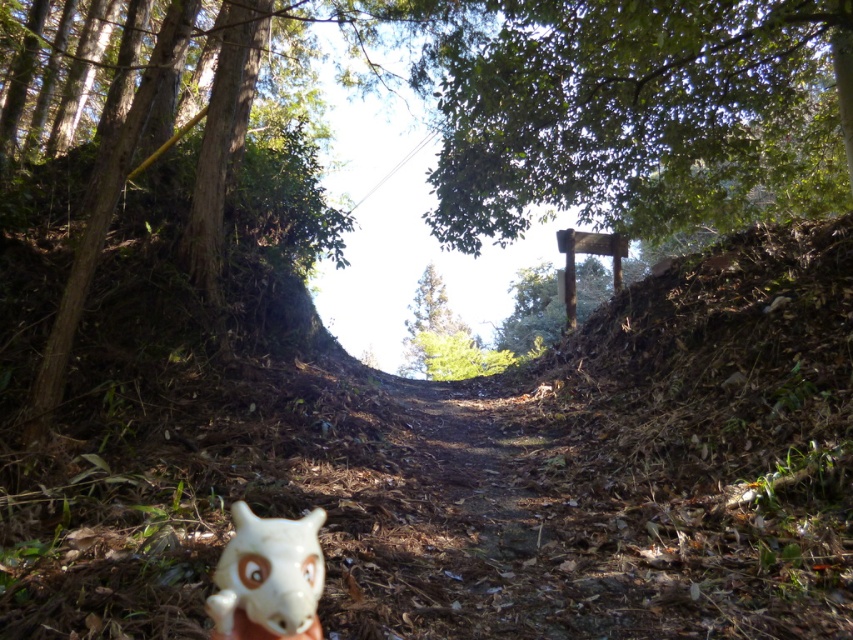
Question: Does green leafy tree at upper center appear on the right side of green matte tree at center?

Choices:
 (A) yes
 (B) no

Answer: (A)

Question: Is white matte plush toy at lower left further to the viewer compared to green matte tree at center?

Choices:
 (A) no
 (B) yes

Answer: (A)

Question: Which point is closer to the camera taking this photo?

Choices:
 (A) (444, 228)
 (B) (235, 570)
 (C) (430, 260)

Answer: (B)

Question: Which point appears closest to the camera in this image?

Choices:
 (A) (567, 147)
 (B) (430, 314)

Answer: (A)

Question: Is the position of green leafy tree at upper center less distant than that of green matte tree at center?

Choices:
 (A) no
 (B) yes

Answer: (B)

Question: Which object is farther from the camera taking this photo?

Choices:
 (A) green matte tree at center
 (B) white matte plush toy at lower left

Answer: (A)